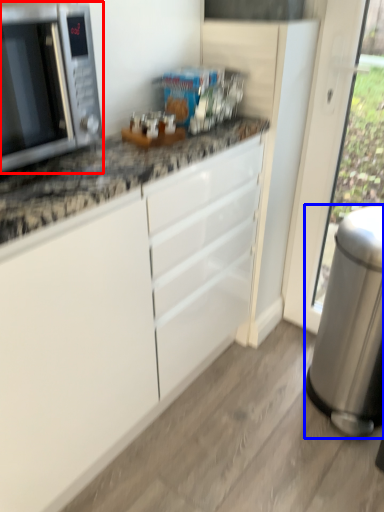
Question: Which object appears farthest to the camera in this image, microwave oven (highlighted by a red box) or appliance (highlighted by a blue box)?

Choices:
 (A) microwave oven
 (B) appliance

Answer: (B)